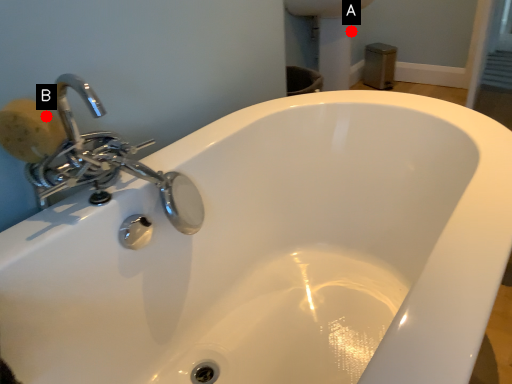
Question: Two points are circled on the image, labeled by A and B beside each circle. Which point is closer to the camera?

Choices:
 (A) A is closer
 (B) B is closer

Answer: (B)